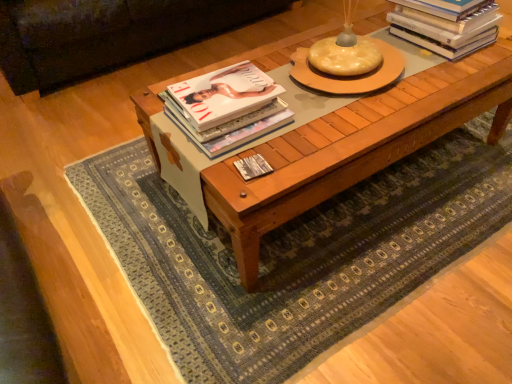
Question: Can you confirm if matte hardcover book at center, which is the 3th book in right-to-left order, is wider than white glossy book at center, the 2th book when ordered from right to left?

Choices:
 (A) no
 (B) yes

Answer: (B)

Question: Does matte hardcover book at center, the second book from the bottom, appear on the left side of white glossy book at center, the third book viewed from the top?

Choices:
 (A) yes
 (B) no

Answer: (A)

Question: Considering the relative positions of matte hardcover book at center, placed as the second book when sorted from top to bottom, and white glossy book at center, the 2th book when ordered from right to left, in the image provided, is matte hardcover book at center, placed as the second book when sorted from top to bottom, behind white glossy book at center, the 2th book when ordered from right to left,?

Choices:
 (A) no
 (B) yes

Answer: (B)

Question: Does matte hardcover book at center, the second book from the bottom, turn towards white glossy book at center, placed as the 2th book when sorted from left to right?

Choices:
 (A) yes
 (B) no

Answer: (B)

Question: Can you confirm if matte hardcover book at center, placed as the second book when sorted from top to bottom, is bigger than white glossy book at center, the third book viewed from the top?

Choices:
 (A) no
 (B) yes

Answer: (B)

Question: From their relative heights in the image, would you say white glossy book at center, placed as the 2th book when sorted from left to right, is taller or shorter than wooden coffee table at center?

Choices:
 (A) tall
 (B) short

Answer: (B)

Question: Considering the relative positions of white glossy book at center, the 2th book when ordered from right to left, and wooden coffee table at center in the image provided, is white glossy book at center, the 2th book when ordered from right to left, to the left or to the right of wooden coffee table at center?

Choices:
 (A) right
 (B) left

Answer: (B)

Question: Would you say white glossy book at center, the 2th book when ordered from right to left, is inside or outside wooden coffee table at center?

Choices:
 (A) inside
 (B) outside

Answer: (A)

Question: Looking at the image, does white glossy book at center, placed as the 2th book when sorted from left to right, seem bigger or smaller compared to wooden coffee table at center?

Choices:
 (A) big
 (B) small

Answer: (B)

Question: Considering the positions of white glossy book at center, placed as the 2th book when sorted from left to right, and dark brown leather couch at upper left in the image, is white glossy book at center, placed as the 2th book when sorted from left to right, taller or shorter than dark brown leather couch at upper left?

Choices:
 (A) short
 (B) tall

Answer: (A)

Question: Is white glossy book at center, the 1th book positioned from the bottom, in front of or behind dark brown leather couch at upper left in the image?

Choices:
 (A) front
 (B) behind

Answer: (A)

Question: Looking at their shapes, would you say white glossy book at center, the 2th book when ordered from right to left, is wider or thinner than dark brown leather couch at upper left?

Choices:
 (A) wide
 (B) thin

Answer: (B)

Question: Does point pos(243,158) appear closer or farther from the camera than point pos(129,28)?

Choices:
 (A) closer
 (B) farther

Answer: (A)

Question: Visually, is white glossy book at center, the third book viewed from the top, positioned to the left or to the right of matte hardcover book at center, placed as the second book when sorted from top to bottom?

Choices:
 (A) right
 (B) left

Answer: (A)

Question: Is point (254, 173) closer or farther from the camera than point (241, 100)?

Choices:
 (A) farther
 (B) closer

Answer: (B)